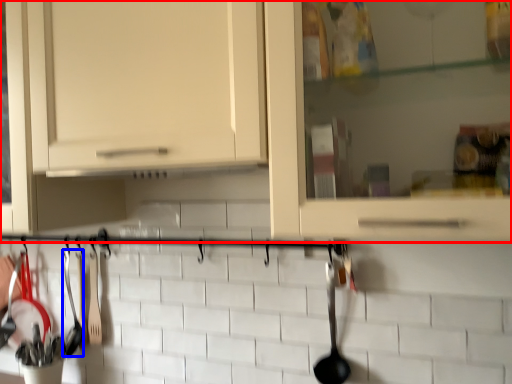
Question: Which object is closer to the camera taking this photo, cabinetry (highlighted by a red box) or silverware (highlighted by a blue box)?

Choices:
 (A) cabinetry
 (B) silverware

Answer: (A)